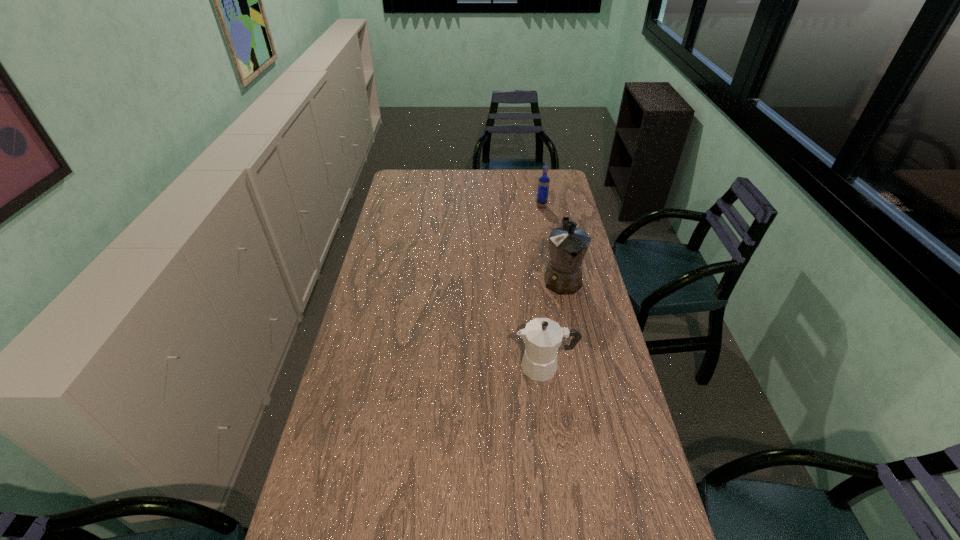
Image resolution: width=960 pixels, height=540 pixels. Identify the location of the tallest object. (568, 245).

I want to click on the second nearest object, so click(x=568, y=245).

You are a GUI agent. You are given a task and a screenshot of the screen. Output one action in this format:
    pyautogui.click(x=<x>, y=<y>)
    Task: Click on the vodka
    The image size is (960, 540).
    Given the screenshot: What is the action you would take?
    pyautogui.click(x=543, y=186)

Where is `the nearer coffeepot`? The height and width of the screenshot is (540, 960). the nearer coffeepot is located at coordinates (542, 336).

Find the location of a particular element. This screenshot has height=540, width=960. the nearest object is located at coordinates (542, 336).

Find the location of a particular element. vacant region located 0.350m on the pouring side of the tallest object is located at coordinates (583, 380).

I want to click on free space located on the left of the farthest object, so tap(466, 206).

Locate an element on the screen. This screenshot has height=540, width=960. vacant area located 0.140m at the spout of the nearer coffeepot is located at coordinates (470, 367).

Identify the location of vacant space located at the spout of the nearer coffeepot. (391, 367).

You are a GUI agent. You are given a task and a screenshot of the screen. Output one action in this format:
    pyautogui.click(x=<x>, y=<y>)
    Task: Click on the blank area located at the spout of the nearer coffeepot
    This screenshot has height=540, width=960.
    Given the screenshot: What is the action you would take?
    pyautogui.click(x=402, y=367)